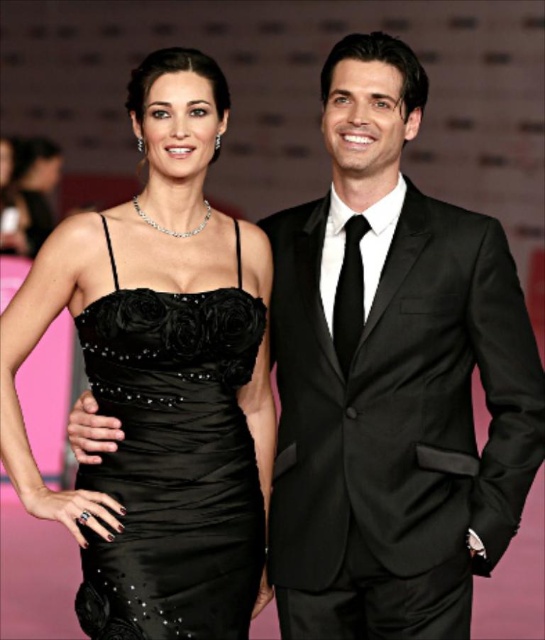
You are a photographer at the event and need to position the two subjects so that both are visible in the frame. The shiny black suit at right and the black satin dress at center are the two subjects. Given their heights, which subject should be placed closer to the camera to ensure both are fully visible?

The shiny black suit at right is taller than the black satin dress at center. To ensure both are fully visible, the taller subject, the shiny black suit at right, should be placed closer to the camera while the shorter one is positioned slightly further back. This way, the height difference is balanced, and both subjects can be captured clearly in the frame.

You are a photographer at the event. You need to capture a photo where both the shiny black suit at right and the black satin dress at center are clearly visible. Based on their positions, which one should you focus on first to ensure both are in frame?

The shiny black suit at right is located above the black satin dress at center, so focusing on the dress first will ensure the suit remains in the frame as well.

You are a photographer at the event and want to focus on the two points in the image. Which point, point [426,484] or point [196,372], is closer to your camera lens?

Point [426,484] is closer to the camera lens than point [196,372].